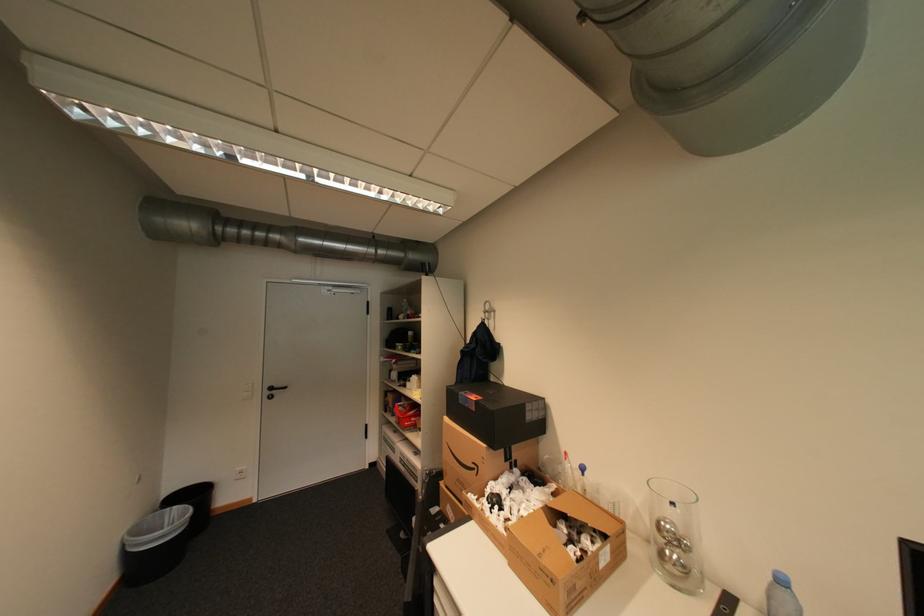
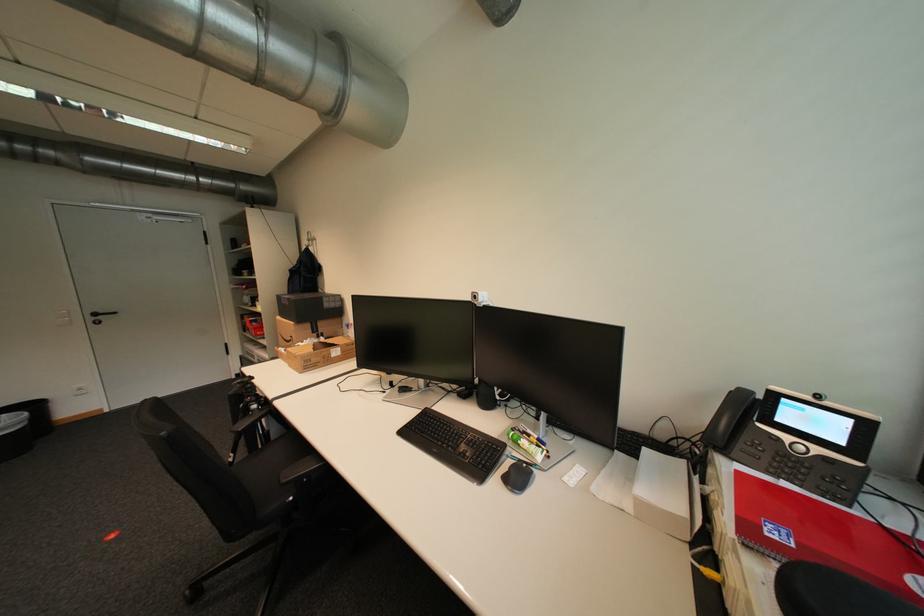
What movement of the cameraman would produce the second image?

The cameraman walked toward right, backward.